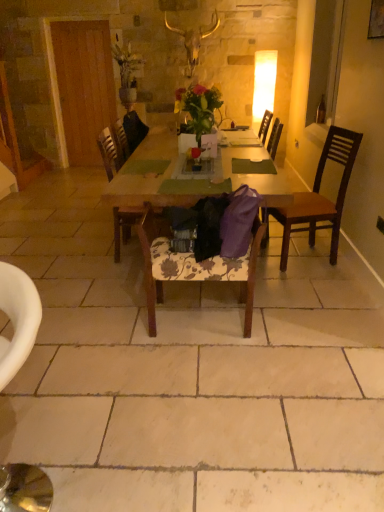
Question: Does wooden chair at center, positioned as the third chair in right-to-left order, have a smaller size compared to wooden picture frame at upper right?

Choices:
 (A) no
 (B) yes

Answer: (A)

Question: Is wooden chair at center, arranged as the second chair when viewed from the left, turned away from wooden picture frame at upper right?

Choices:
 (A) no
 (B) yes

Answer: (A)

Question: Could wooden picture frame at upper right be considered to be inside wooden chair at center, arranged as the second chair when viewed from the left?

Choices:
 (A) yes
 (B) no

Answer: (B)

Question: Can you confirm if wooden chair at center, arranged as the second chair when viewed from the left, is taller than wooden picture frame at upper right?

Choices:
 (A) no
 (B) yes

Answer: (B)

Question: From a real-world perspective, is wooden chair at center, arranged as the second chair when viewed from the left, below wooden picture frame at upper right?

Choices:
 (A) yes
 (B) no

Answer: (A)

Question: From a real-world perspective, does wooden chair at center, positioned as the 4th chair in front-to-back order, stand above wooden picture frame at upper right?

Choices:
 (A) no
 (B) yes

Answer: (A)

Question: Is brown wooden chair at right, which is the second chair from back to front, not near vibrant floral bouquet at center?

Choices:
 (A) yes
 (B) no

Answer: (A)

Question: From a real-world perspective, is brown wooden chair at right, which is the fourth chair from left to right, positioned over vibrant floral bouquet at center based on gravity?

Choices:
 (A) yes
 (B) no

Answer: (B)

Question: Is the position of brown wooden chair at right, which is the first chair in right-to-left order, more distant than that of vibrant floral bouquet at center?

Choices:
 (A) yes
 (B) no

Answer: (B)

Question: Is brown wooden chair at right, which is the first chair in right-to-left order, facing towards vibrant floral bouquet at center?

Choices:
 (A) no
 (B) yes

Answer: (A)

Question: From the image's perspective, is brown wooden chair at right, which is the fourth chair from left to right, over vibrant floral bouquet at center?

Choices:
 (A) no
 (B) yes

Answer: (A)

Question: Is vibrant floral bouquet at center a part of brown wooden chair at right, which is the second chair from back to front?

Choices:
 (A) no
 (B) yes

Answer: (A)

Question: Does floral fabric chair at center, the second chair viewed from the right, have a greater height compared to brown wooden chair at right, positioned as the third chair in front-to-back order?

Choices:
 (A) no
 (B) yes

Answer: (A)